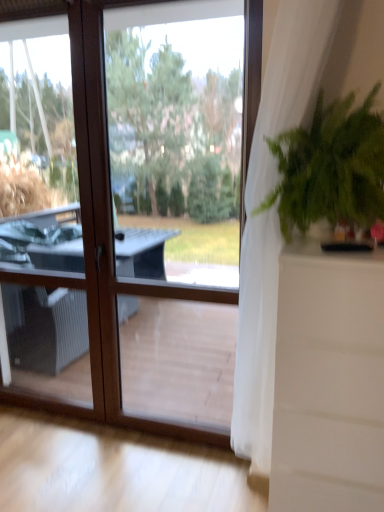
Question: Does transparent glass window at center have a greater height compared to white sheer curtain at right?

Choices:
 (A) yes
 (B) no

Answer: (A)

Question: Considering the relative sizes of transparent glass window at center and white sheer curtain at right in the image provided, is transparent glass window at center smaller than white sheer curtain at right?

Choices:
 (A) yes
 (B) no

Answer: (B)

Question: Does transparent glass window at center have a greater width compared to white sheer curtain at right?

Choices:
 (A) no
 (B) yes

Answer: (A)

Question: Can you confirm if transparent glass window at center is bigger than white sheer curtain at right?

Choices:
 (A) no
 (B) yes

Answer: (B)

Question: Can you confirm if transparent glass window at center is positioned to the right of white sheer curtain at right?

Choices:
 (A) yes
 (B) no

Answer: (B)

Question: Do you think transparent glass window at center is within green leafy plant at right, or outside of it?

Choices:
 (A) inside
 (B) outside

Answer: (B)

Question: Is transparent glass window at center taller or shorter than green leafy plant at right?

Choices:
 (A) tall
 (B) short

Answer: (A)

Question: Is transparent glass window at center bigger or smaller than green leafy plant at right?

Choices:
 (A) big
 (B) small

Answer: (A)

Question: Is point (99, 4) positioned closer to the camera than point (301, 206)?

Choices:
 (A) farther
 (B) closer

Answer: (A)

Question: In the image, is white sheer curtain at right on the left side or the right side of green leafy plant at right?

Choices:
 (A) right
 (B) left

Answer: (B)

Question: Is white sheer curtain at right taller or shorter than green leafy plant at right?

Choices:
 (A) short
 (B) tall

Answer: (B)

Question: Considering their positions, is white sheer curtain at right located in front of or behind green leafy plant at right?

Choices:
 (A) behind
 (B) front

Answer: (B)

Question: Which is correct: white sheer curtain at right is inside green leafy plant at right, or outside of it?

Choices:
 (A) outside
 (B) inside

Answer: (A)

Question: Looking at the image, does white sheer curtain at right seem bigger or smaller compared to transparent glass window at center?

Choices:
 (A) small
 (B) big

Answer: (A)

Question: Choose the correct answer: Is white sheer curtain at right inside transparent glass window at center or outside it?

Choices:
 (A) outside
 (B) inside

Answer: (A)